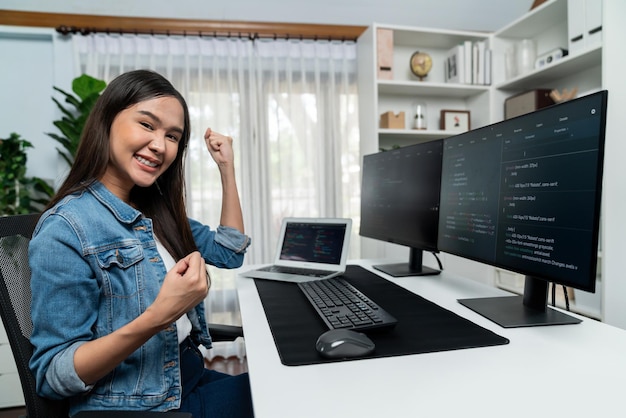
Locate an element on the screen. The width and height of the screenshot is (626, 418). computer monitor is located at coordinates (402, 203), (484, 200), (313, 238).